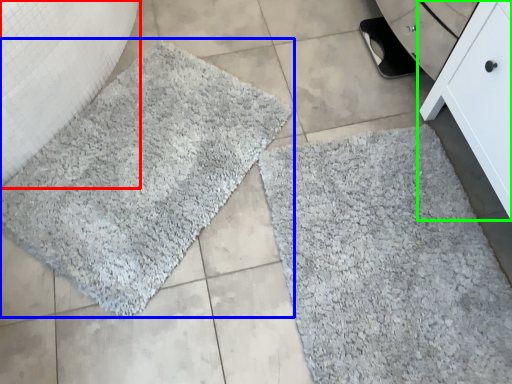
Question: Based on their relative distances, which object is nearer to granite (highlighted by a red box)? Choose from bath mat (highlighted by a blue box) and furniture (highlighted by a green box).

Choices:
 (A) bath mat
 (B) furniture

Answer: (A)